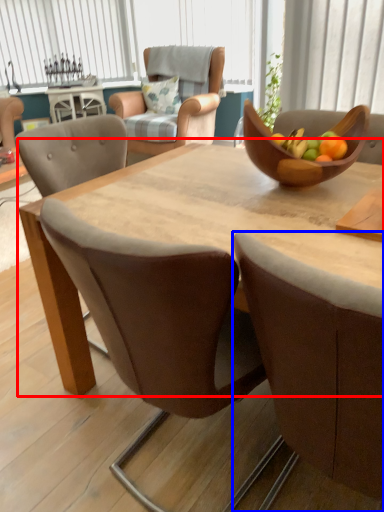
Question: Which point is closer to the camera, round table (highlighted by a red box) or chair (highlighted by a blue box)?

Choices:
 (A) round table
 (B) chair

Answer: (B)